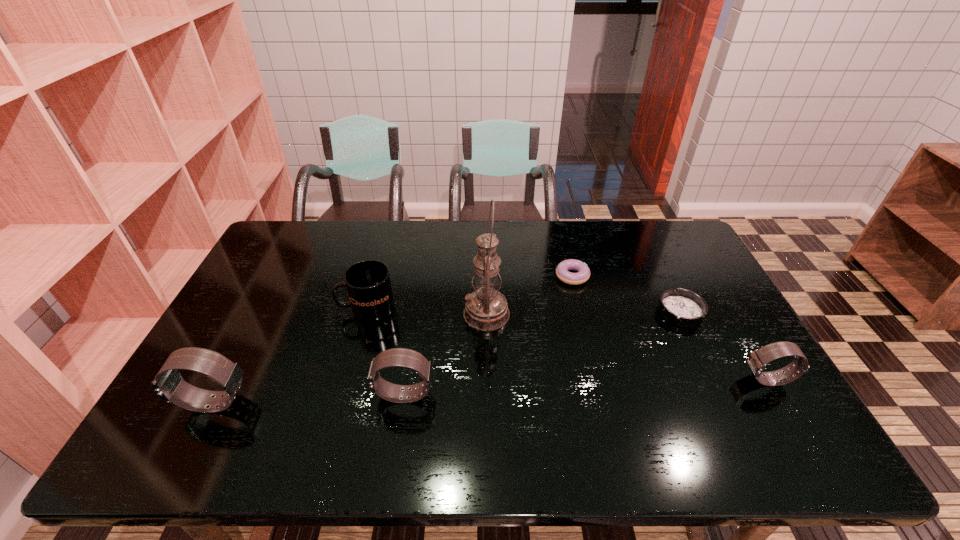
This screenshot has width=960, height=540. I want to click on unoccupied position between the mug and the rightmost watch, so click(567, 344).

Identify the location of object that ranks as the third closest to the second watch from left to right. The height and width of the screenshot is (540, 960). (169, 385).

Select which object appears as the fifth closest to the leftmost watch. Please provide its 2D coordinates. Your answer should be formatted as a tuple, i.e. [(x, y)], where the tuple contains the x and y coordinates of a point satisfying the conditions above.

[(682, 307)]

Where is `watch that is the second closest to the sixth object from left to right`? watch that is the second closest to the sixth object from left to right is located at coordinates (402, 357).

This screenshot has width=960, height=540. What are the coordinates of `watch identified as the second closest to the farthest object` in the screenshot? It's located at [x=402, y=357].

The image size is (960, 540). Identify the location of free spot that satisfies the following two spatial constraints: 1. with the handle on the side of the tallest object; 2. on the right side of the mug. (366, 314).

Locate an element on the screen. free location that satisfies the following two spatial constraints: 1. on the front side of the farthest object; 2. on the face of the leftmost object is located at coordinates (603, 403).

Locate an element on the screen. The image size is (960, 540). free space that satisfies the following two spatial constraints: 1. on the front side of the oil lamp; 2. on the face of the second tallest watch is located at coordinates (488, 395).

The height and width of the screenshot is (540, 960). I want to click on free space that satisfies the following two spatial constraints: 1. on the front side of the sixth object from left to right; 2. on the face of the leftmost watch, so click(724, 403).

This screenshot has width=960, height=540. In order to click on vacant region that satisfies the following two spatial constraints: 1. on the front side of the farthest object; 2. on the right side of the ashtray in this screenshot , I will do `click(581, 312)`.